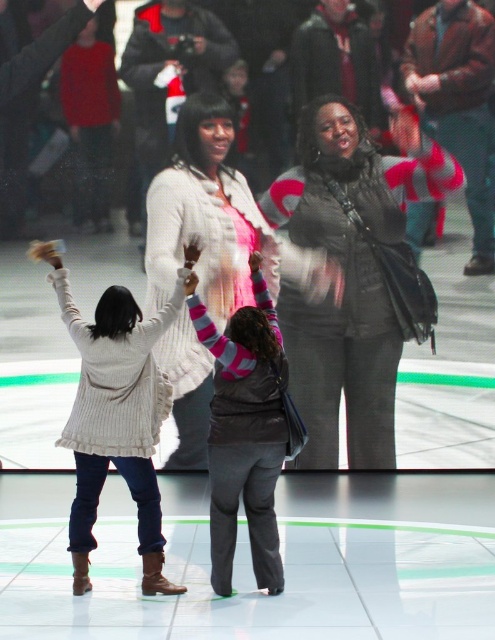
The image size is (495, 640). Describe the element at coordinates (343, 296) in the screenshot. I see `matte black vest at center` at that location.

Measure the distance between matte black vest at center and camera.

The distance of matte black vest at center from camera is 32.58 feet.

Is point (378, 330) positioned after point (258, 273)?

Yes.

This screenshot has width=495, height=640. I want to click on matte black vest at center, so click(343, 296).

Can you confirm if white knit sweater at center is shorter than white knitted sweater at center?

Incorrect, white knit sweater at center's height does not fall short of white knitted sweater at center's.

Does white knit sweater at center have a greater width compared to white knitted sweater at center?

Indeed, white knit sweater at center has a greater width compared to white knitted sweater at center.

Where is `white knit sweater at center`? This screenshot has height=640, width=495. white knit sweater at center is located at coordinates (205, 216).

You are a GUI agent. You are given a task and a screenshot of the screen. Output one action in this format:
    pyautogui.click(x=<x>, y=<y>)
    Task: Click on the matte black vest at center
    The height and width of the screenshot is (640, 495).
    Given the screenshot: What is the action you would take?
    pyautogui.click(x=343, y=296)

In the scene shown: Can you confirm if matte black vest at center is thinner than white knit sweater at center?

Indeed, matte black vest at center has a lesser width compared to white knit sweater at center.

Which is in front, point (319, 428) or point (203, 156)?

Point (203, 156) is more forward.

Find the location of a particular element. matte black vest at center is located at coordinates (343, 296).